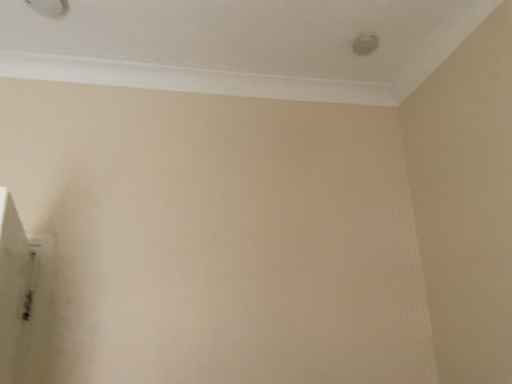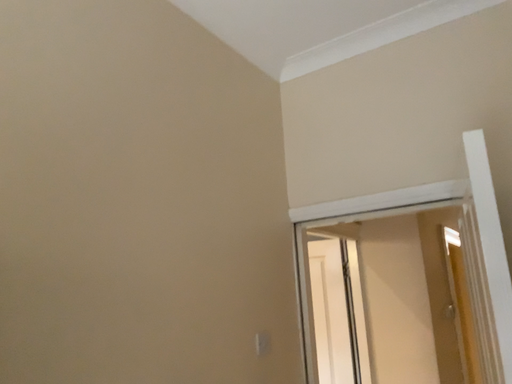
Question: How did the camera likely rotate when shooting the video?

Choices:
 (A) rotated left
 (B) rotated right

Answer: (A)